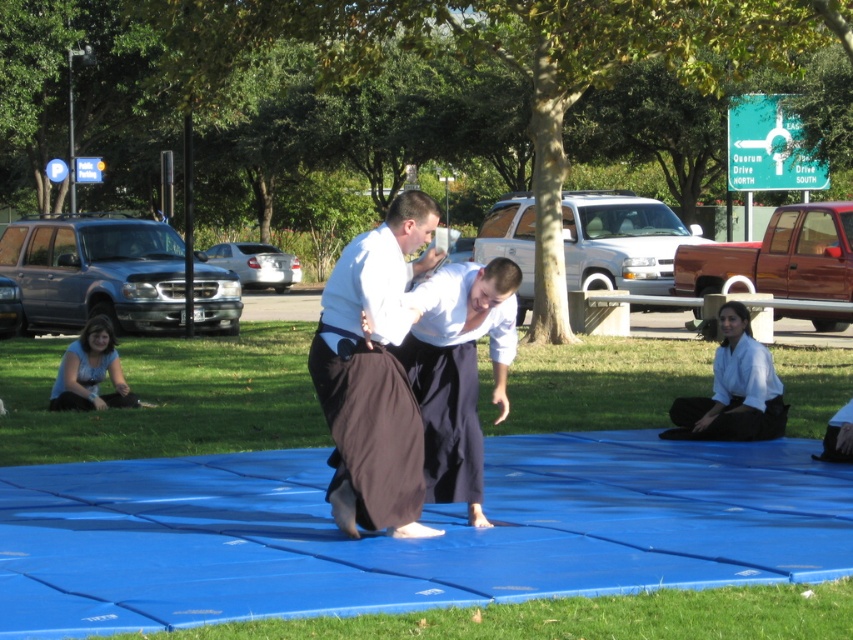
Identify the location of dark brown fabric kimono at center. (373, 376).

Does dark brown fabric kimono at center have a greater height compared to blue fabric at lower left?

No, dark brown fabric kimono at center is not taller than blue fabric at lower left.

You are a GUI agent. You are given a task and a screenshot of the screen. Output one action in this format:
    pyautogui.click(x=<x>, y=<y>)
    Task: Click on the dark brown fabric kimono at center
    The height and width of the screenshot is (640, 853).
    Given the screenshot: What is the action you would take?
    pyautogui.click(x=373, y=376)